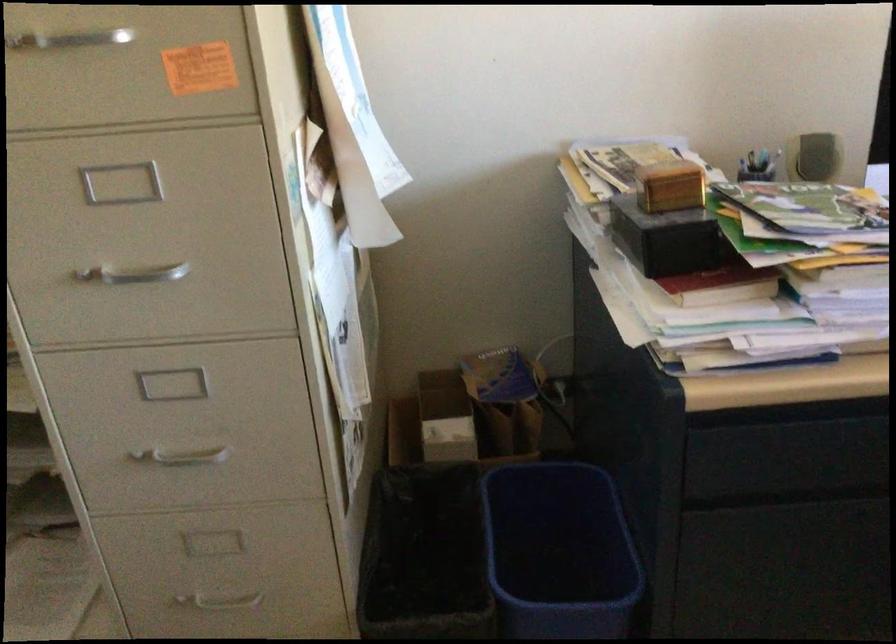
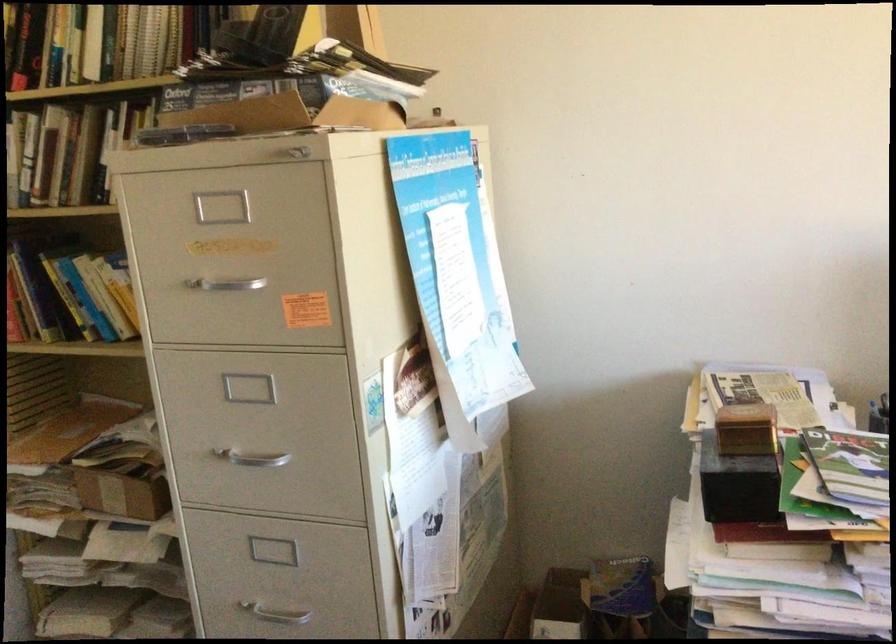
In the second image, find the point that corresponds to [130,272] in the first image.

(251, 458)